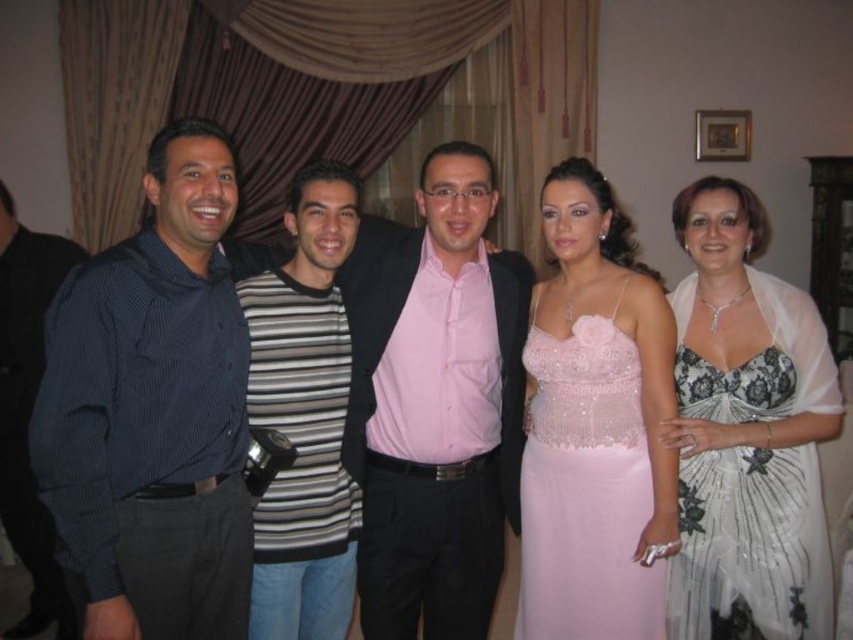
Question: Which of these objects is positioned farthest from the dark blue striped shirt at left?

Choices:
 (A) white lace dress at right
 (B) pink satin dress at center
 (C) dark blue corduroy shirt at left
 (D) striped cotton shirt at center

Answer: (C)

Question: Among these objects, which one is farthest from the camera?

Choices:
 (A) striped cotton shirt at center
 (B) pink satin dress at center

Answer: (A)

Question: Can you confirm if white lace dress at right is thinner than dark blue corduroy shirt at left?

Choices:
 (A) yes
 (B) no

Answer: (B)

Question: Can you confirm if pink satin shirt at center is positioned above white lace dress at right?

Choices:
 (A) yes
 (B) no

Answer: (B)

Question: Is pink satin dress at center positioned at the back of dark blue corduroy shirt at left?

Choices:
 (A) yes
 (B) no

Answer: (B)

Question: Which object appears closest to the camera in this image?

Choices:
 (A) white lace dress at right
 (B) pink satin shirt at center
 (C) pink satin dress at center

Answer: (C)